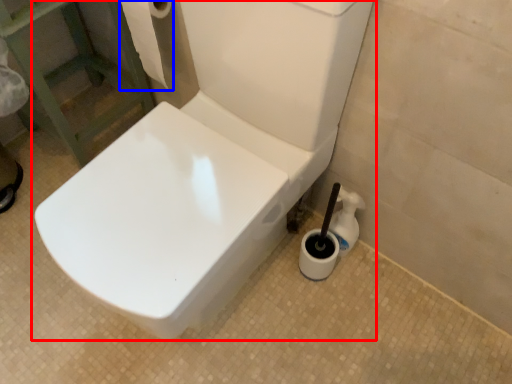
Question: Which object appears farthest to the camera in this image, toilet (highlighted by a red box) or toilet paper (highlighted by a blue box)?

Choices:
 (A) toilet
 (B) toilet paper

Answer: (B)